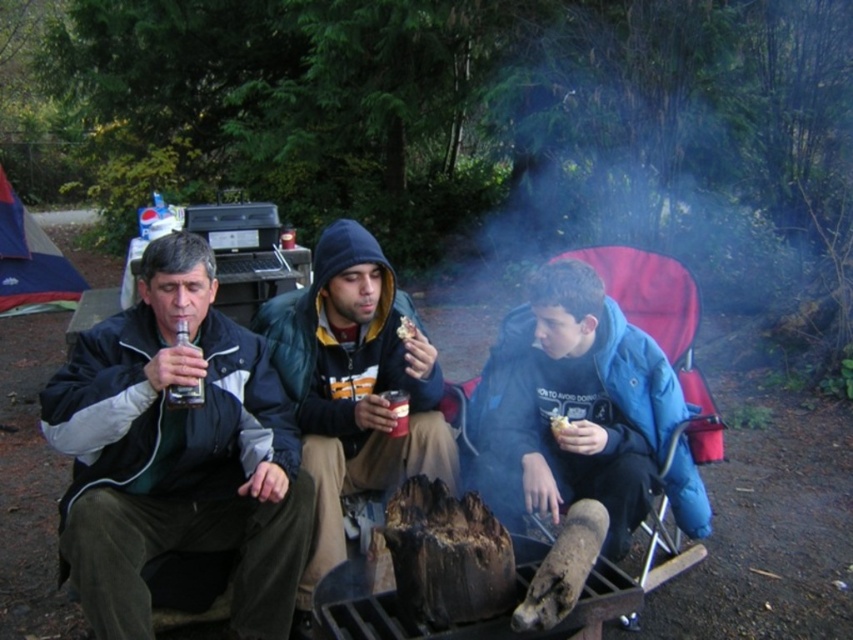
Is dark green jacket at left in front of translucent glass bottle at center?

Yes, dark green jacket at left is in front of translucent glass bottle at center.

Who is more distant from viewer, (132, 577) or (175, 324)?

Positioned behind is point (175, 324).

Describe the element at coordinates (177, 452) in the screenshot. I see `dark green jacket at left` at that location.

The height and width of the screenshot is (640, 853). I want to click on dark green jacket at left, so click(177, 452).

Which is in front, point (397, 330) or point (566, 417)?

Point (566, 417) is more forward.

Which is above, smooth brown bread at center or white crumbly bread at center?

Positioned higher is smooth brown bread at center.

Where is `smooth brown bread at center`? The image size is (853, 640). smooth brown bread at center is located at coordinates (405, 328).

Is point (408, 541) in front of point (187, 397)?

Yes, it is in front of point (187, 397).

Which is behind, point (486, 614) or point (193, 387)?

The point (193, 387) is more distant.

Locate an element on the screen. This screenshot has height=640, width=853. charcoal black log at center is located at coordinates (447, 556).